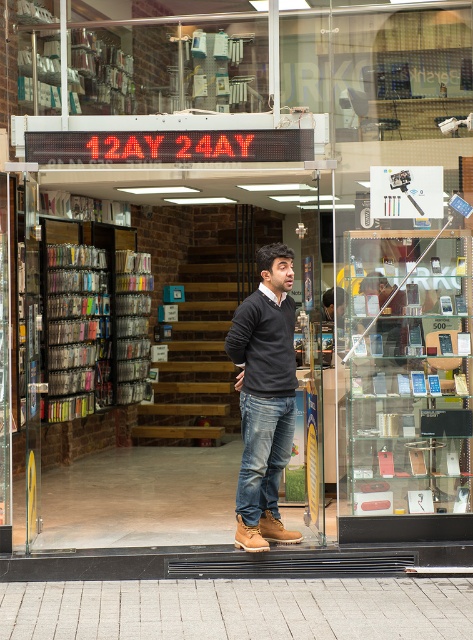
Who is shorter, dark gray sweater at center or metallic silver books at left?

dark gray sweater at center

Find the location of a particular element. dark gray sweater at center is located at coordinates (264, 397).

This screenshot has height=640, width=473. Identify the location of dark gray sweater at center. (264, 397).

Locate an element on the screen. dark gray sweater at center is located at coordinates (264, 397).

Is transparent glass display case at center further to the viewer compared to metallic silver books at left?

No, it is not.

The width and height of the screenshot is (473, 640). In order to click on transparent glass display case at center in this screenshot , I will do `click(406, 385)`.

Who is lower down, transparent glass display case at center or dark gray sweater at center?

dark gray sweater at center

Between transparent glass display case at center and dark gray sweater at center, which one has more height?

transparent glass display case at center

Who is more forward, (419, 228) or (280, 280)?

Positioned in front is point (280, 280).

The height and width of the screenshot is (640, 473). I want to click on transparent glass display case at center, so click(x=406, y=385).